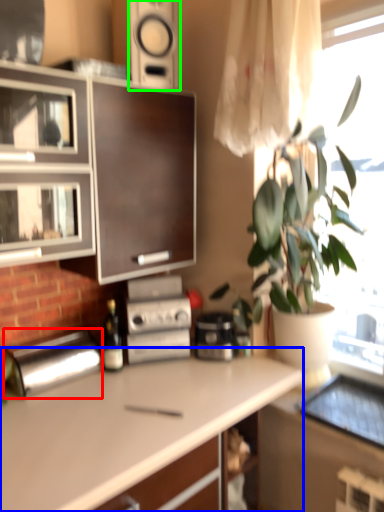
Question: Considering the real-world distances, which object is closest to appliance (highlighted by a red box)? countertop (highlighted by a blue box) or speaker (highlighted by a green box).

Choices:
 (A) countertop
 (B) speaker

Answer: (A)